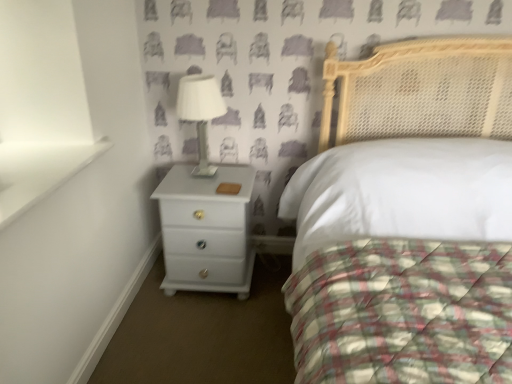
This screenshot has width=512, height=384. What are the coordinates of `vacant space in front of white glossy table lamp at upper center` in the screenshot? It's located at (203, 186).